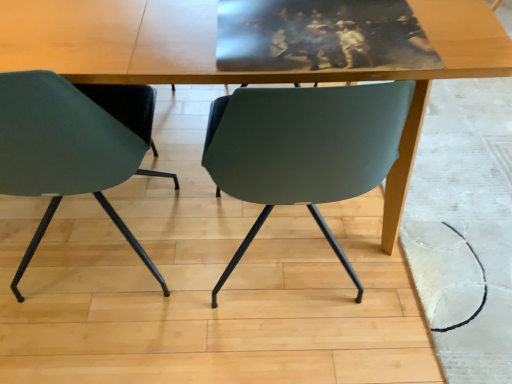
Question: Should I look upward or downward to see wooden table at center?

Choices:
 (A) down
 (B) up

Answer: (B)

Question: Does wooden table at center lie behind matte green chair at left?

Choices:
 (A) no
 (B) yes

Answer: (B)

Question: From the image's perspective, is wooden table at center on matte green chair at left?

Choices:
 (A) yes
 (B) no

Answer: (A)

Question: Is matte green chair at left completely or partially inside wooden table at center?

Choices:
 (A) yes
 (B) no

Answer: (A)

Question: Is wooden table at center to the right of matte green chair at left from the viewer's perspective?

Choices:
 (A) yes
 (B) no

Answer: (A)

Question: Can you confirm if wooden table at center is wider than matte green chair at left?

Choices:
 (A) yes
 (B) no

Answer: (A)

Question: Can you confirm if wooden table at center is positioned to the left of matte green chair at left?

Choices:
 (A) no
 (B) yes

Answer: (A)

Question: Considering the relative positions of matte green chair at left and wooden table at center in the image provided, is matte green chair at left to the right of wooden table at center from the viewer's perspective?

Choices:
 (A) yes
 (B) no

Answer: (B)

Question: Considering the relative positions of matte green chair at left and wooden table at center in the image provided, is matte green chair at left to the left of wooden table at center from the viewer's perspective?

Choices:
 (A) no
 (B) yes

Answer: (B)

Question: From the image's perspective, is matte green chair at left above wooden table at center?

Choices:
 (A) yes
 (B) no

Answer: (B)

Question: Is matte green chair at left looking in the opposite direction of wooden table at center?

Choices:
 (A) yes
 (B) no

Answer: (A)

Question: Considering the relative sizes of matte green chair at left and wooden table at center in the image provided, is matte green chair at left wider than wooden table at center?

Choices:
 (A) yes
 (B) no

Answer: (B)

Question: Is matte green chair at left in front of wooden table at center?

Choices:
 (A) yes
 (B) no

Answer: (A)

Question: Which is correct: wooden table at center is inside matte green chair at left, or outside of it?

Choices:
 (A) outside
 (B) inside

Answer: (A)